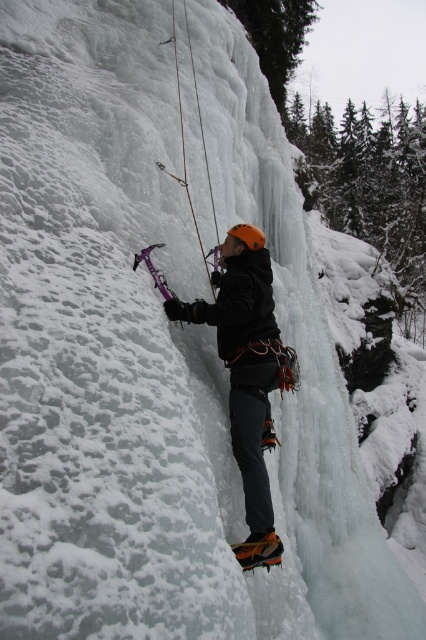
Who is taller, matte black jacket at center or orange matte helmet at center?

matte black jacket at center

Does matte black jacket at center appear on the right side of orange matte helmet at center?

Incorrect, matte black jacket at center is not on the right side of orange matte helmet at center.

Which is behind, point (238, 426) or point (252, 225)?

The point (252, 225) is more distant.

The height and width of the screenshot is (640, 426). What are the coordinates of `matte black jacket at center` in the screenshot? It's located at pos(247,378).